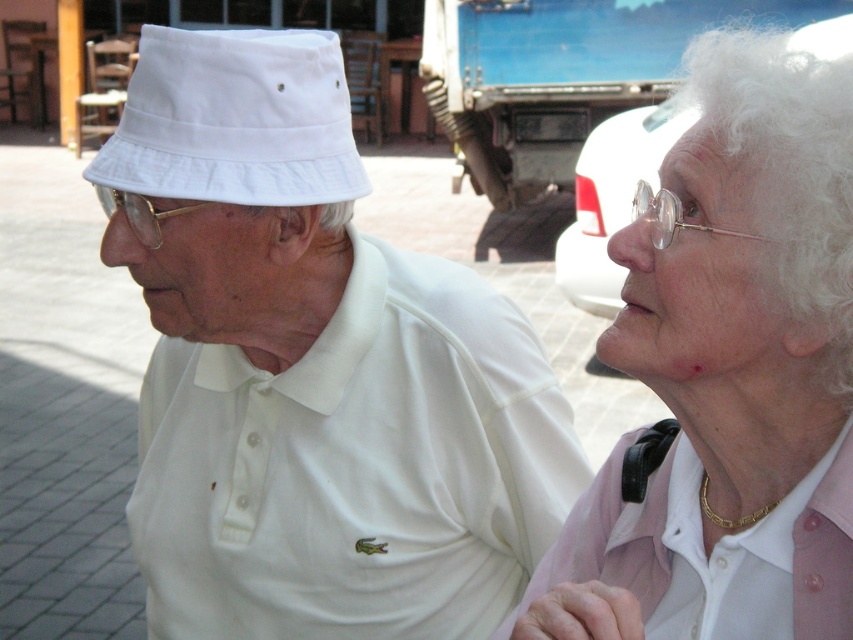
The image size is (853, 640). What do you see at coordinates (312, 371) in the screenshot? I see `white matte hat at left` at bounding box center [312, 371].

Which of these two, white matte hat at left or white cotton bucket hat at left, stands shorter?

With less height is white cotton bucket hat at left.

Is point (407, 545) farther from camera compared to point (155, 52)?

That is True.

Where is `white matte hat at left`? white matte hat at left is located at coordinates click(x=312, y=371).

Can you confirm if pink satin blouse at upper right is taller than white cotton bucket hat at left?

Correct, pink satin blouse at upper right is much taller as white cotton bucket hat at left.

How much distance is there between pink satin blouse at upper right and white cotton bucket hat at left?

pink satin blouse at upper right is 35.59 inches away from white cotton bucket hat at left.

Describe the element at coordinates (728, 372) in the screenshot. I see `pink satin blouse at upper right` at that location.

Where is `pink satin blouse at upper right`? pink satin blouse at upper right is located at coordinates (728, 372).

Is white matte hat at left closer to the viewer compared to pink satin blouse at upper right?

No.

Can you confirm if white matte hat at left is positioned below pink satin blouse at upper right?

Incorrect, white matte hat at left is not positioned below pink satin blouse at upper right.

Who is more distant from viewer, (193, 428) or (701, 547)?

Positioned behind is point (193, 428).

The image size is (853, 640). In order to click on white matte hat at left in this screenshot , I will do `click(312, 371)`.